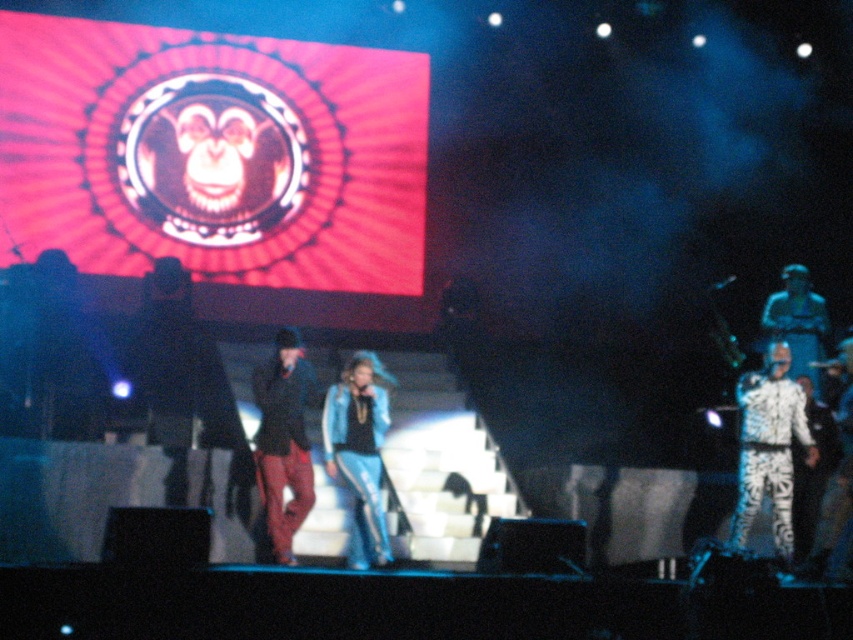
You are an event planner standing at the back of the venue. You want to ensure that the blue denim jacket at center worn by the performer is clearly visible to the audience seated in the back rows. Based on the given distance, can you estimate if the jacket will be visible from there?

The blue denim jacket at center is 41.26 feet away from the viewer. Since this distance is within typical visibility ranges for stage performances, the jacket should be visible to the audience in the back rows.